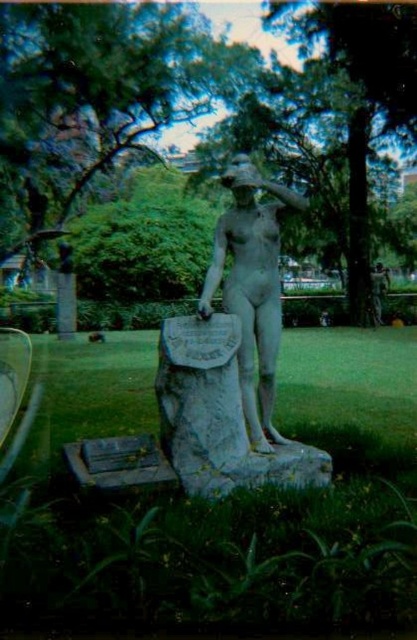
You are a park visitor who wants to take a photo of the matte stone statue at center from the dark gray stone bench at center. Can you see the entire statue in the photo if you sit on the bench?

The matte stone statue at center is taller than the dark gray stone bench at center, so if you sit on the dark gray stone bench at center, you might not be able to see the top of the statue in the photo because the bench is shorter than the statue.

You are a park visitor holding a 3 feet long kite string. You want to fly your kite near the statue. If you stand at the base of the matte stone statue at center, will your kite string reach the nearest tree branch that is 5.21 feet away from the statue?

The nearest tree branch is 5.21 feet away from the matte stone statue at center. Since your kite string is 3 feet long, it is shorter than the distance to the branch, so the kite string will not reach the nearest tree branch that is 5.21 feet away from the matte stone statue at center.

You are a visitor in the park and want to sit on the dark gray stone bench at center. To reach it, you have to walk from the matte stone statue at center. Which direction should you move relative to the statue?

The matte stone statue at center is closer to you than the dark gray stone bench at center, so you should move away from the statue to reach the bench.